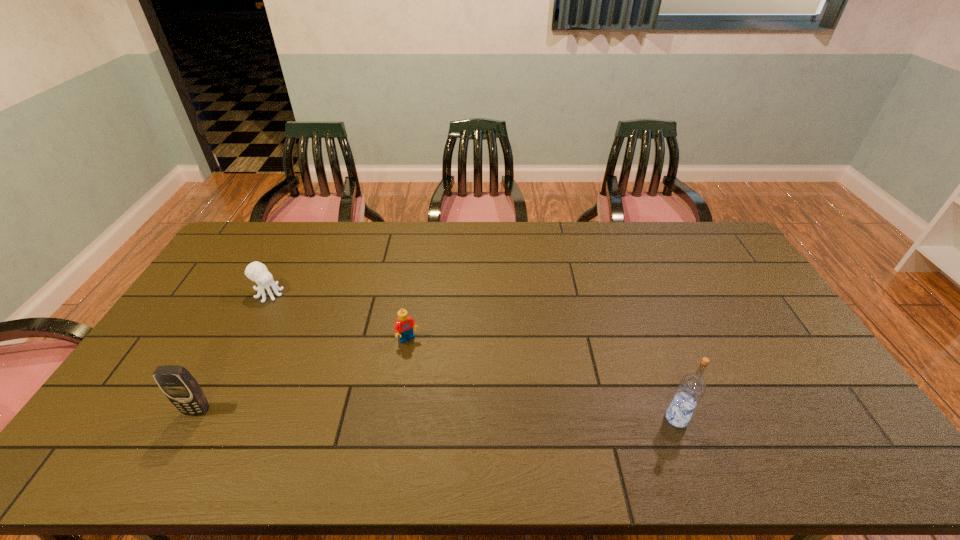
The width and height of the screenshot is (960, 540). I want to click on the third shortest object, so pyautogui.click(x=180, y=387).

Identify the location of vodka. (691, 388).

The width and height of the screenshot is (960, 540). What are the coordinates of `the rightmost object` in the screenshot? It's located at (691, 388).

The image size is (960, 540). I want to click on Lego, so click(x=403, y=327).

Where is `the second object from right to left`? the second object from right to left is located at coordinates (403, 327).

Find the location of `octopus`. octopus is located at coordinates (255, 271).

Find the location of a particular element. free space located on the right of the vodka is located at coordinates (719, 418).

Where is `vacant space situated 0.280m on the face of the second farthest object`? Image resolution: width=960 pixels, height=540 pixels. vacant space situated 0.280m on the face of the second farthest object is located at coordinates (461, 419).

I want to click on free spot located 0.140m on the face of the second farthest object, so click(436, 380).

Find the location of a particular element. free location located 0.130m on the face of the second farthest object is located at coordinates (434, 378).